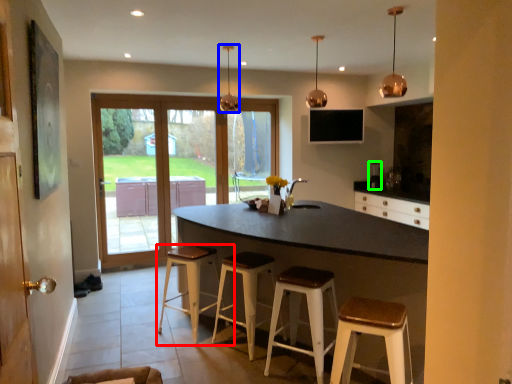
Question: Considering the real-world distances, which object is farthest from stool (highlighted by a red box)? light fixture (highlighted by a blue box) or appliance (highlighted by a green box)?

Choices:
 (A) light fixture
 (B) appliance

Answer: (B)